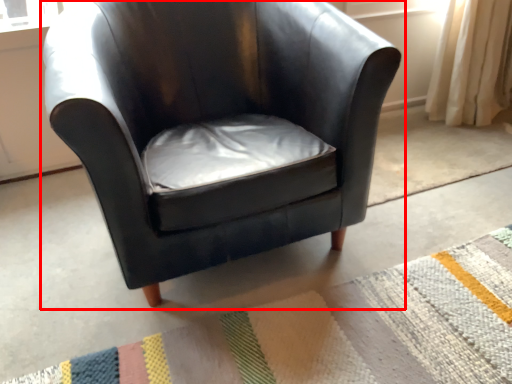
Question: Considering the relative positions of chair (annotated by the red box) and mat in the image provided, where is chair (annotated by the red box) located with respect to the staircase?

Choices:
 (A) right
 (B) left

Answer: (B)